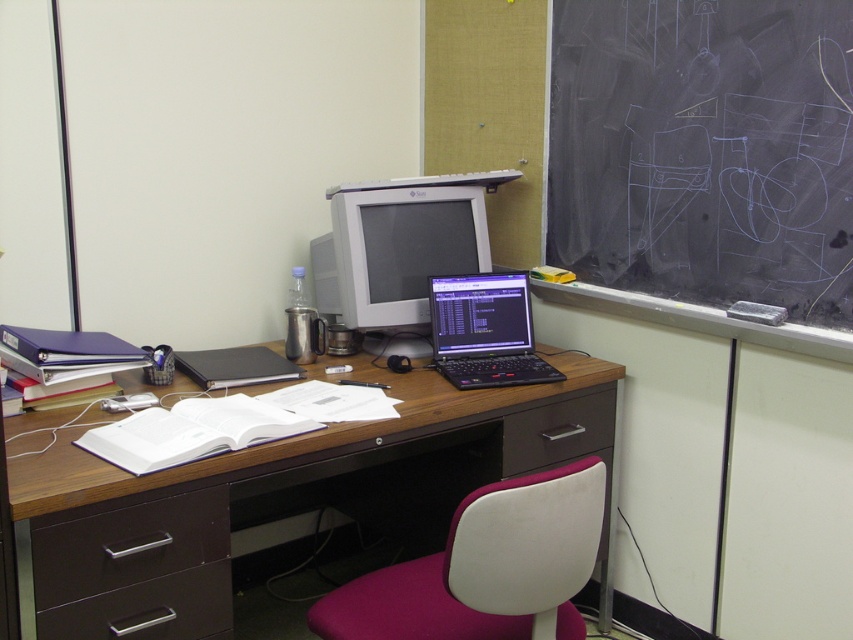
Question: Is white fabric swivel chair at center below brown matte drawer at lower left?

Choices:
 (A) no
 (B) yes

Answer: (B)

Question: Among these points, which one is nearest to the camera?

Choices:
 (A) (543, 371)
 (B) (216, 616)
 (C) (485, 515)
 (D) (598, 188)

Answer: (C)

Question: Which is nearer to the matte gray monitor at center?

Choices:
 (A) black chalkboard at upper right
 (B) matte black drawer at lower left
 (C) black matte laptop at center

Answer: (C)

Question: Does black matte laptop at center appear over dark brown wood drawer at lower center?

Choices:
 (A) yes
 (B) no

Answer: (A)

Question: Where is black matte laptop at center located in relation to matte black drawer at lower left in the image?

Choices:
 (A) right
 (B) left

Answer: (A)

Question: Which object is the closest to the dark brown wood drawer at lower center?

Choices:
 (A) matte gray monitor at center
 (B) black matte laptop at center

Answer: (B)